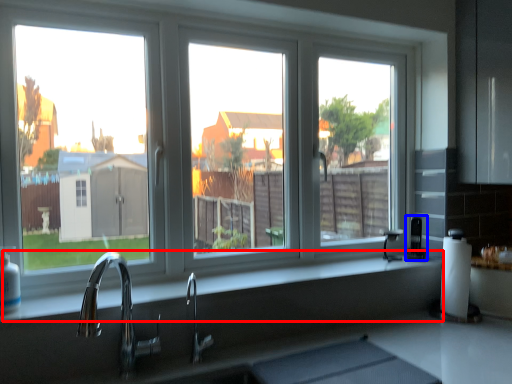
Question: Which object appears closest to the camera in this image, counter top (highlighted by a red box) or appliance (highlighted by a blue box)?

Choices:
 (A) counter top
 (B) appliance

Answer: (A)